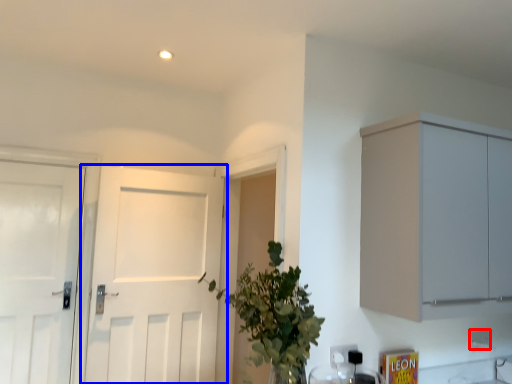
Question: Which object appears closest to the camera in this image, electric outlet (highlighted by a red box) or door (highlighted by a blue box)?

Choices:
 (A) electric outlet
 (B) door

Answer: (B)